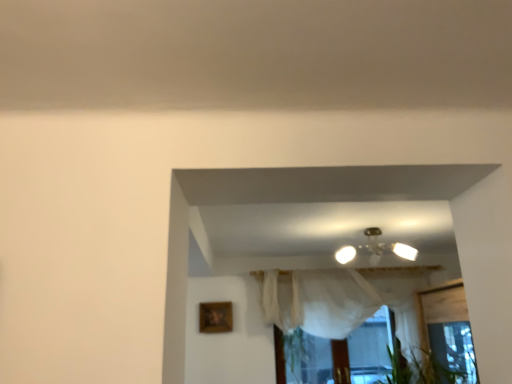
What is the approximate width of white sheer curtain at center?

white sheer curtain at center is 28.43 centimeters wide.

Locate an element on the screen. wooden picture frame at lower left is located at coordinates (215, 317).

Where is `metallic glass chandelier at center`? metallic glass chandelier at center is located at coordinates (x=385, y=247).

Find the location of a particular element. white sheer curtain at center is located at coordinates (323, 298).

Can you confirm if metallic glass chandelier at center is positioned to the left of wooden picture frame at lower left?

No.

From a real-world perspective, between metallic glass chandelier at center and wooden picture frame at lower left, who is vertically higher?

metallic glass chandelier at center.

Is metallic glass chandelier at center wider than wooden picture frame at lower left?

Indeed, metallic glass chandelier at center has a greater width compared to wooden picture frame at lower left.

Is metallic glass chandelier at center far from white sheer curtain at center?

metallic glass chandelier at center is near white sheer curtain at center, not far away.

Considering the relative sizes of metallic glass chandelier at center and white sheer curtain at center in the image provided, is metallic glass chandelier at center taller than white sheer curtain at center?

In fact, metallic glass chandelier at center may be shorter than white sheer curtain at center.

Between metallic glass chandelier at center and white sheer curtain at center, which one has smaller size?

With smaller size is metallic glass chandelier at center.

Could you tell me if metallic glass chandelier at center is facing white sheer curtain at center?

No, metallic glass chandelier at center is not turned towards white sheer curtain at center.

In the scene shown: From a real-world perspective, is wooden picture frame at lower left above or below metallic glass chandelier at center?

From a real-world perspective, wooden picture frame at lower left is physically below metallic glass chandelier at center.

Are wooden picture frame at lower left and metallic glass chandelier at center far apart?

Yes, wooden picture frame at lower left is far from metallic glass chandelier at center.

Does wooden picture frame at lower left have a greater height compared to metallic glass chandelier at center?

Correct, wooden picture frame at lower left is much taller as metallic glass chandelier at center.

Is wooden picture frame at lower left oriented towards metallic glass chandelier at center?

No, wooden picture frame at lower left is not turned towards metallic glass chandelier at center.

Considering the positions of objects white sheer curtain at center and wooden picture frame at lower left in the image provided, who is in front, white sheer curtain at center or wooden picture frame at lower left?

white sheer curtain at center is closer to the camera.

Is white sheer curtain at center oriented away from wooden picture frame at lower left?

No, white sheer curtain at center is not facing away from wooden picture frame at lower left.

Considering the sizes of objects white sheer curtain at center and wooden picture frame at lower left in the image provided, who is smaller, white sheer curtain at center or wooden picture frame at lower left?

With smaller size is wooden picture frame at lower left.

From a real-world perspective, which object rests below the other?

white sheer curtain at center, from a real-world perspective.

Measure the distance from white sheer curtain at center to metallic glass chandelier at center.

They are 22.49 inches apart.

The height and width of the screenshot is (384, 512). What are the coordinates of `curtain below the metallic glass chandelier at center (from a real-world perspective)` in the screenshot? It's located at coord(323,298).

How many degrees apart are the facing directions of white sheer curtain at center and metallic glass chandelier at center?

The angle between the facing direction of white sheer curtain at center and the facing direction of metallic glass chandelier at center is 6.25 degrees.

From the image's perspective, would you say white sheer curtain at center is positioned over metallic glass chandelier at center?

No, from the image's perspective, white sheer curtain at center is not on top of metallic glass chandelier at center.

Is wooden picture frame at lower left further to camera compared to white sheer curtain at center?

Yes, wooden picture frame at lower left is further from the viewer.

This screenshot has height=384, width=512. Identify the location of curtain to the right of wooden picture frame at lower left. (323, 298).

How many degrees apart are the facing directions of wooden picture frame at lower left and white sheer curtain at center?

There is a 4.51-degree angle between the facing directions of wooden picture frame at lower left and white sheer curtain at center.

How distant is wooden picture frame at lower left from white sheer curtain at center?

37.73 inches.

Locate an element on the screen. This screenshot has width=512, height=384. picture frame below the metallic glass chandelier at center (from a real-world perspective) is located at coordinates (215, 317).

Find the location of a particular element. This screenshot has width=512, height=384. lamp located above the white sheer curtain at center (from the image's perspective) is located at coordinates (385, 247).

From the image, which object appears to be nearer to wooden picture frame at lower left, metallic glass chandelier at center or white sheer curtain at center?

white sheer curtain at center.

From the image, which object appears to be farther from metallic glass chandelier at center, wooden picture frame at lower left or white sheer curtain at center?

wooden picture frame at lower left is positioned further to the anchor metallic glass chandelier at center.

From the image, which object appears to be farther from white sheer curtain at center, metallic glass chandelier at center or wooden picture frame at lower left?

Based on the image, wooden picture frame at lower left appears to be further to white sheer curtain at center.

Based on their spatial positions, is white sheer curtain at center or metallic glass chandelier at center closer to wooden picture frame at lower left?

The object closer to wooden picture frame at lower left is white sheer curtain at center.

Based on their spatial positions, is white sheer curtain at center or wooden picture frame at lower left closer to metallic glass chandelier at center?

Among the two, white sheer curtain at center is located nearer to metallic glass chandelier at center.

Which object lies nearer to the anchor point white sheer curtain at center, wooden picture frame at lower left or metallic glass chandelier at center?

metallic glass chandelier at center is closer to white sheer curtain at center.

Identify the location of lamp between wooden picture frame at lower left and white sheer curtain at center in the horizontal direction. The width and height of the screenshot is (512, 384). (385, 247).